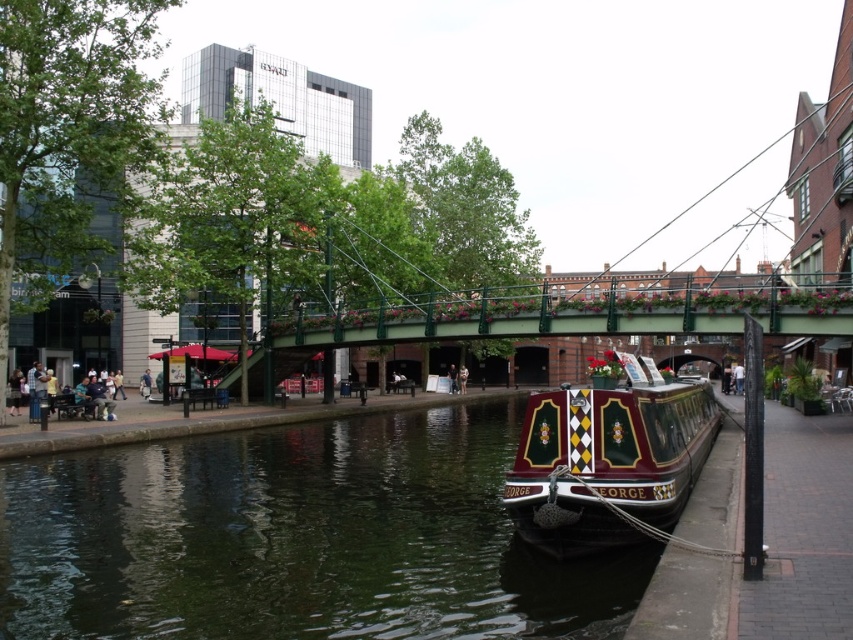
Can you confirm if green smooth water at lower center is taller than polished dark wood barge at lower right?

No, green smooth water at lower center is not taller than polished dark wood barge at lower right.

Is green smooth water at lower center above polished dark wood barge at lower right?

Actually, green smooth water at lower center is below polished dark wood barge at lower right.

Does point (387, 492) come in front of point (590, 422)?

No, (387, 492) is behind (590, 422).

I want to click on green smooth water at lower center, so click(297, 538).